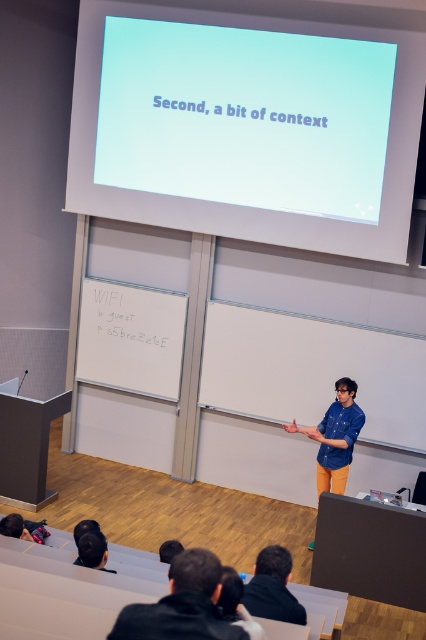
You are a photographer in the lecture hall and want to capture a photo of the denim shirt at center and black fabric jacket at lower center. Which object should you focus on first if you want to ensure both are in sharp focus?

The denim shirt at center is much taller than the black fabric jacket at lower center. To ensure both are in sharp focus, you should focus on the denim shirt at center because it is farther away and has a greater depth of field requirement.

Looking at this image, you are a photographer taking a picture of the lecture hall. You notice two points marked in the image. The first point is at coordinates point (189, 88) and the second is at point (282, 596). Which point is closer to the camera?

Point (189, 88) is further to the camera than point (282, 596), so the closer point to the camera is point (282, 596).

You are standing in the lecture hall and want to take a photo of the point at coordinates [345,436]. Your camera has a maximum focus range of 20 feet. Will the camera be able to focus on the point?

The point at coordinates [345,436] is 18.10 feet away from the camera. Since the camera can focus up to 20 feet, it will be able to focus on the point.